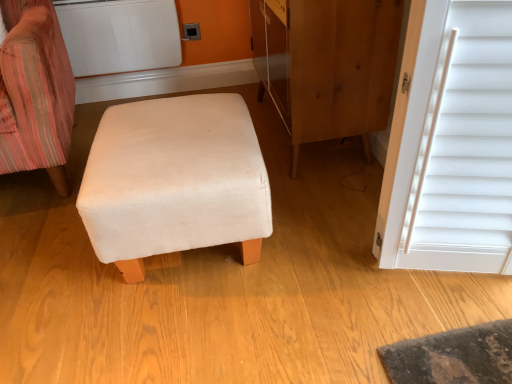
Image resolution: width=512 pixels, height=384 pixels. What are the coordinates of `matte plastic outlet at upper center` in the screenshot? It's located at (191, 31).

Is wooden dresser at center further to camera compared to matte plastic outlet at upper center?

That is False.

In the scene shown: Considering the sizes of objects wooden dresser at center and matte plastic outlet at upper center in the image provided, who is taller, wooden dresser at center or matte plastic outlet at upper center?

wooden dresser at center.

Who is smaller, wooden dresser at center or matte plastic outlet at upper center?

With smaller size is matte plastic outlet at upper center.

Does wooden dresser at center appear on the left side of matte plastic outlet at upper center?

No.

Is beige fabric ottoman at center completely or partially outside of matte plastic outlet at upper center?

That's correct, beige fabric ottoman at center is outside of matte plastic outlet at upper center.

Considering the relative sizes of beige fabric ottoman at center and matte plastic outlet at upper center in the image provided, is beige fabric ottoman at center smaller than matte plastic outlet at upper center?

No, beige fabric ottoman at center is not smaller than matte plastic outlet at upper center.

Looking at this image, is beige fabric ottoman at center facing away from matte plastic outlet at upper center?

No, beige fabric ottoman at center is not facing the opposite direction of matte plastic outlet at upper center.

Is the position of beige fabric ottoman at center less distant than that of white matte radiator at upper left?

Yes, the depth of beige fabric ottoman at center is less than that of white matte radiator at upper left.

The image size is (512, 384). I want to click on furniture lying on the right of white matte radiator at upper left, so click(x=174, y=180).

Can you tell me how much beige fabric ottoman at center and white matte radiator at upper left differ in facing direction?

The angle between the facing direction of beige fabric ottoman at center and the facing direction of white matte radiator at upper left is 89.3 degrees.

Which of these two, beige fabric ottoman at center or white matte radiator at upper left, is smaller?

With smaller size is white matte radiator at upper left.

Is white matte radiator at upper left surrounding matte plastic outlet at upper center?

No, matte plastic outlet at upper center is not inside white matte radiator at upper left.

You are a GUI agent. You are given a task and a screenshot of the screen. Output one action in this format:
    pyautogui.click(x=<x>, y=<y>)
    Task: Click on the appliance that appears in front of the matte plastic outlet at upper center
    This screenshot has width=512, height=384.
    Given the screenshot: What is the action you would take?
    pyautogui.click(x=119, y=35)

Looking at this image, does white matte radiator at upper left have a greater height compared to matte plastic outlet at upper center?

Yes.

Looking at this image, looking at the image, does velvet striped chair at left seem bigger or smaller compared to white matte radiator at upper left?

Clearly, velvet striped chair at left is larger in size than white matte radiator at upper left.

Which is more to the right, velvet striped chair at left or white matte radiator at upper left?

From the viewer's perspective, white matte radiator at upper left appears more on the right side.

In the scene shown: Is velvet striped chair at left placed right next to white matte radiator at upper left?

No, velvet striped chair at left is not touching white matte radiator at upper left.

Looking at this image, from the image's perspective, is velvet striped chair at left above or below white matte radiator at upper left?

velvet striped chair at left is below white matte radiator at upper left.

Choose the correct answer: Is matte plastic outlet at upper center inside velvet striped chair at left or outside it?

matte plastic outlet at upper center is located beyond the bounds of velvet striped chair at left.

From the image's perspective, would you say matte plastic outlet at upper center is shown under velvet striped chair at left?

No, from the image's perspective, matte plastic outlet at upper center is not beneath velvet striped chair at left.

Is matte plastic outlet at upper center at the left side of velvet striped chair at left?

No.

Is velvet striped chair at left at the back of matte plastic outlet at upper center?

matte plastic outlet at upper center is not turned away from velvet striped chair at left.

Is wooden dresser at center to the left or to the right of white matte radiator at upper left in the image?

In the image, wooden dresser at center appears on the right side of white matte radiator at upper left.

Considering the positions of point (382, 85) and point (137, 70), is point (382, 85) closer or farther from the camera than point (137, 70)?

Point (382, 85) is closer to the camera than point (137, 70).

Is wooden dresser at center positioned with its back to white matte radiator at upper left?

That's not correct — wooden dresser at center is not looking away from white matte radiator at upper left.

You are a GUI agent. You are given a task and a screenshot of the screen. Output one action in this format:
    pyautogui.click(x=<x>, y=<y>)
    Task: Click on the dresser above the matte plastic outlet at upper center (from a real-world perspective)
    The height and width of the screenshot is (384, 512).
    Given the screenshot: What is the action you would take?
    pyautogui.click(x=327, y=65)

The height and width of the screenshot is (384, 512). What are the coordinates of `furniture in front of the matte plastic outlet at upper center` in the screenshot? It's located at (174, 180).

Looking at the image, which one is located further to wooden dresser at center, white matte radiator at upper left or matte plastic outlet at upper center?

Based on the image, matte plastic outlet at upper center appears to be further to wooden dresser at center.

Based on their spatial positions, is velvet striped chair at left or beige fabric ottoman at center closer to matte plastic outlet at upper center?

velvet striped chair at left is closer to matte plastic outlet at upper center.

When comparing their distances from white matte radiator at upper left, does wooden dresser at center or beige fabric ottoman at center seem further?

beige fabric ottoman at center is further to white matte radiator at upper left.

Estimate the real-world distances between objects in this image. Which object is further from velvet striped chair at left, beige fabric ottoman at center or matte plastic outlet at upper center?

Based on the image, matte plastic outlet at upper center appears to be further to velvet striped chair at left.

When comparing their distances from matte plastic outlet at upper center, does white matte radiator at upper left or beige fabric ottoman at center seem closer?

white matte radiator at upper left lies closer to matte plastic outlet at upper center than the other object.

Based on their spatial positions, is matte plastic outlet at upper center or white matte radiator at upper left further from velvet striped chair at left?

matte plastic outlet at upper center lies further to velvet striped chair at left than the other object.

Estimate the real-world distances between objects in this image. Which object is closer to wooden dresser at center, matte plastic outlet at upper center or beige fabric ottoman at center?

Based on the image, beige fabric ottoman at center appears to be nearer to wooden dresser at center.

From the image, which object appears to be nearer to beige fabric ottoman at center, velvet striped chair at left or white matte radiator at upper left?

Based on the image, velvet striped chair at left appears to be nearer to beige fabric ottoman at center.

The height and width of the screenshot is (384, 512). Find the location of `appliance located between wooden dresser at center and matte plastic outlet at upper center in the depth direction`. appliance located between wooden dresser at center and matte plastic outlet at upper center in the depth direction is located at coordinates (119, 35).

Image resolution: width=512 pixels, height=384 pixels. I want to click on appliance between beige fabric ottoman at center and matte plastic outlet at upper center in the front-back direction, so click(119, 35).

Find the location of a particular element. Image resolution: width=512 pixels, height=384 pixels. appliance between velvet striped chair at left and matte plastic outlet at upper center in the front-back direction is located at coordinates (119, 35).

The image size is (512, 384). Find the location of `chair between beige fabric ottoman at center and matte plastic outlet at upper center in the front-back direction`. chair between beige fabric ottoman at center and matte plastic outlet at upper center in the front-back direction is located at coordinates (35, 92).